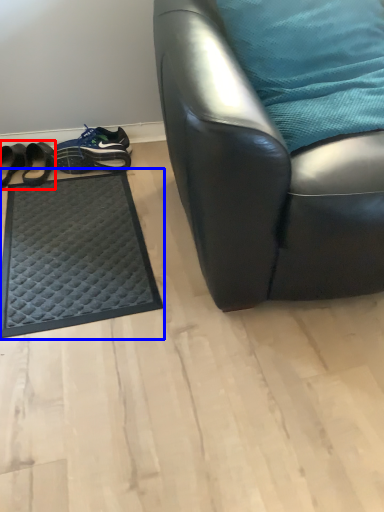
Question: Which point is closer to the camera, footwear (highlighted by a red box) or mat (highlighted by a blue box)?

Choices:
 (A) footwear
 (B) mat

Answer: (B)